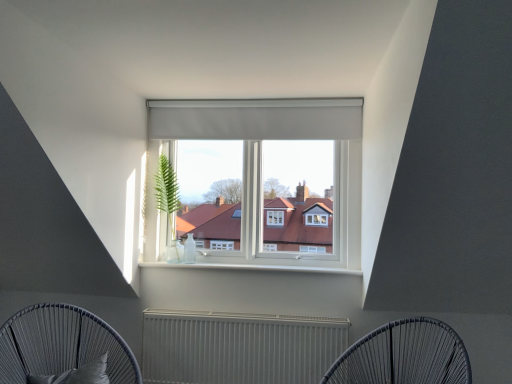
Question: Should I look upward or downward to see metallic wire chair at lower center, placed as the second furniture when sorted from left to right?

Choices:
 (A) down
 (B) up

Answer: (A)

Question: Is black fabric pillow at lower left far from metallic wire chair at lower center, which is the 1th furniture in right-to-left order?

Choices:
 (A) no
 (B) yes

Answer: (B)

Question: Is black fabric pillow at lower left at the left side of metallic wire chair at lower center, which is the 1th furniture in right-to-left order?

Choices:
 (A) yes
 (B) no

Answer: (A)

Question: Is black fabric pillow at lower left turned away from metallic wire chair at lower center, which is the 1th furniture in right-to-left order?

Choices:
 (A) yes
 (B) no

Answer: (B)

Question: Can you confirm if black fabric pillow at lower left is thinner than metallic wire chair at lower center, which is the 1th furniture in right-to-left order?

Choices:
 (A) no
 (B) yes

Answer: (B)

Question: Is black fabric pillow at lower left completely or partially outside of metallic wire chair at lower center, placed as the second furniture when sorted from left to right?

Choices:
 (A) yes
 (B) no

Answer: (A)

Question: Is black fabric pillow at lower left with metallic wire chair at lower center, placed as the second furniture when sorted from left to right?

Choices:
 (A) no
 (B) yes

Answer: (A)

Question: Is green leafy plant at center at the right side of black fabric pillow at lower left?

Choices:
 (A) yes
 (B) no

Answer: (A)

Question: From a real-world perspective, is green leafy plant at center on black fabric pillow at lower left?

Choices:
 (A) no
 (B) yes

Answer: (B)

Question: From a real-world perspective, is green leafy plant at center below black fabric pillow at lower left?

Choices:
 (A) yes
 (B) no

Answer: (B)

Question: Is green leafy plant at center positioned far away from black fabric pillow at lower left?

Choices:
 (A) yes
 (B) no

Answer: (A)

Question: Is green leafy plant at center turned away from black fabric pillow at lower left?

Choices:
 (A) yes
 (B) no

Answer: (B)

Question: Does green leafy plant at center have a greater height compared to black fabric pillow at lower left?

Choices:
 (A) no
 (B) yes

Answer: (B)

Question: Considering the relative sizes of matte gray curtain at center and dark grey woven chair at lower left, which appears as the second furniture when viewed from the right, in the image provided, is matte gray curtain at center taller than dark grey woven chair at lower left, which appears as the second furniture when viewed from the right,?

Choices:
 (A) no
 (B) yes

Answer: (A)